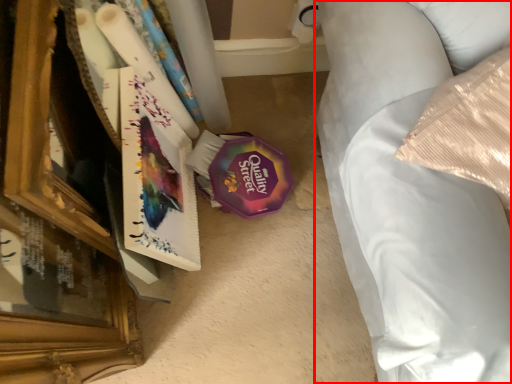
Question: From the image's perspective, where is furniture (annotated by the red box) located in relation to paperback book in the image?

Choices:
 (A) above
 (B) below

Answer: (A)